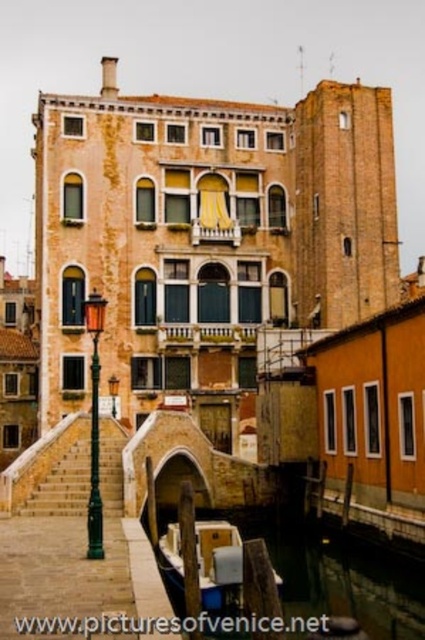
Question: Which object is positioned closest to the yellow stone stairs at lower left?

Choices:
 (A) wooden boat at lower center
 (B) green painted metal streetlamp at left

Answer: (B)

Question: Can you confirm if wooden boat at lower center is positioned to the right of green painted metal streetlamp at left?

Choices:
 (A) no
 (B) yes

Answer: (B)

Question: Does yellow stone stairs at lower left appear on the right side of wooden boat at lower center?

Choices:
 (A) yes
 (B) no

Answer: (B)

Question: Is wooden boat at lower center above green painted metal streetlamp at left?

Choices:
 (A) yes
 (B) no

Answer: (B)

Question: Considering the real-world distances, which object is farthest from the yellow stone stairs at lower left?

Choices:
 (A) green painted metal streetlamp at left
 (B) wooden boat at lower center

Answer: (B)

Question: Which object is positioned farthest from the green painted metal streetlamp at left?

Choices:
 (A) wooden boat at lower center
 (B) yellow stone stairs at lower left

Answer: (A)